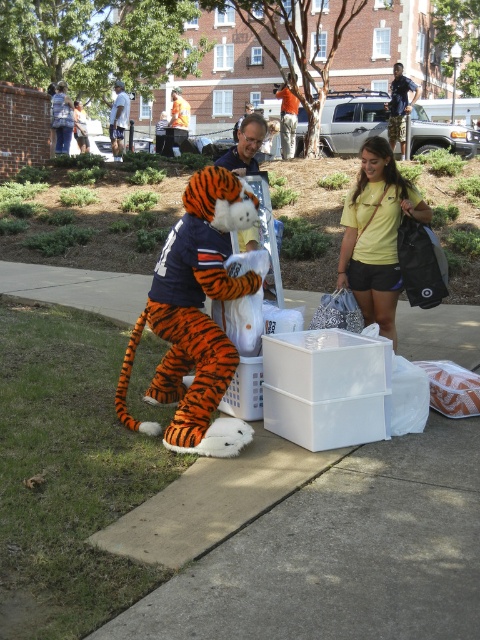
Consider the image. Who is taller, denim shorts at upper right or white t-shirt at center?

denim shorts at upper right is taller.

Does point (411, 90) come closer to viewer compared to point (123, 116)?

Yes.

This screenshot has height=640, width=480. I want to click on denim shorts at upper right, so click(399, 106).

Where is `matte black sunglasses at center`? This screenshot has height=640, width=480. matte black sunglasses at center is located at coordinates (244, 145).

Which of these two, matte black sunglasses at center or white t-shirt at center, stands taller?

With more height is matte black sunglasses at center.

The height and width of the screenshot is (640, 480). What are the coordinates of `matte black sunglasses at center` in the screenshot? It's located at (244, 145).

Find the location of `matte black sunglasses at center`. matte black sunglasses at center is located at coordinates (244, 145).

Looking at this image, does orange cotton t-shirt at upper center have a smaller size compared to white t-shirt at center?

Actually, orange cotton t-shirt at upper center might be larger than white t-shirt at center.

Is point (285, 102) positioned in front of point (111, 150)?

Yes, point (285, 102) is closer to viewer.

Where is `orange cotton t-shirt at upper center`? orange cotton t-shirt at upper center is located at coordinates (288, 118).